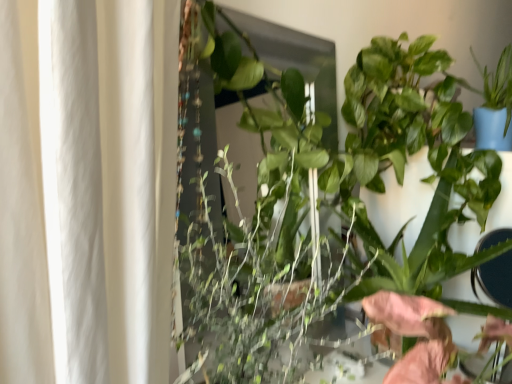
What do you see at coordinates (495, 105) in the screenshot?
I see `blue ceramic pot at upper right` at bounding box center [495, 105].

Measure the distance between point (484, 137) and camera.

The distance of point (484, 137) from camera is 1.03 meters.

I want to click on blue ceramic pot at upper right, so 495,105.

The width and height of the screenshot is (512, 384). I want to click on blue ceramic pot at upper right, so click(495, 105).